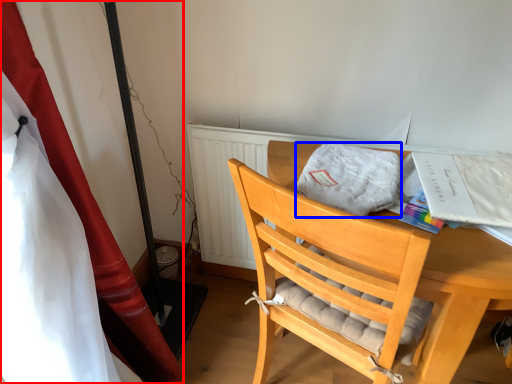
Question: Which object appears farthest to the camera in this image, curtain (highlighted by a red box) or cloth (highlighted by a blue box)?

Choices:
 (A) curtain
 (B) cloth

Answer: (B)